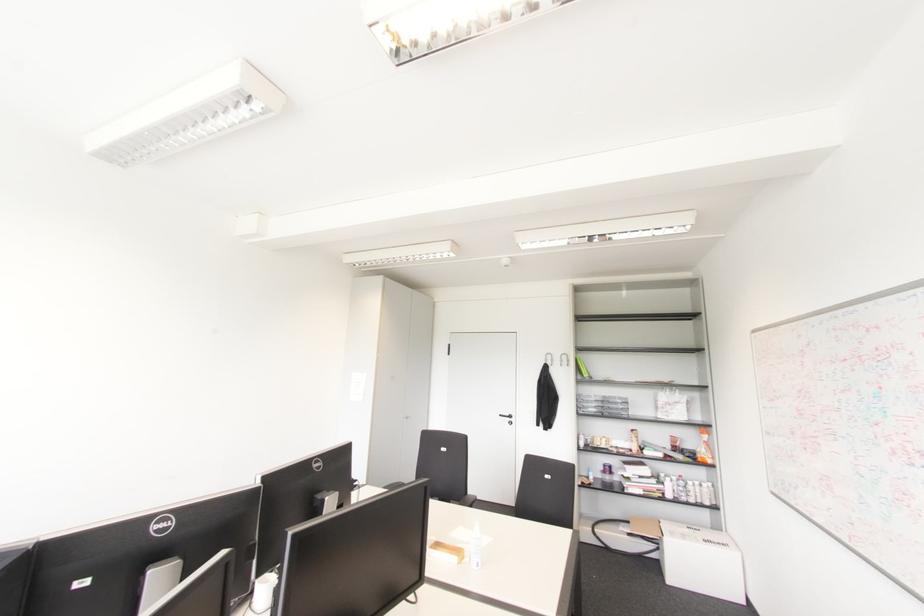
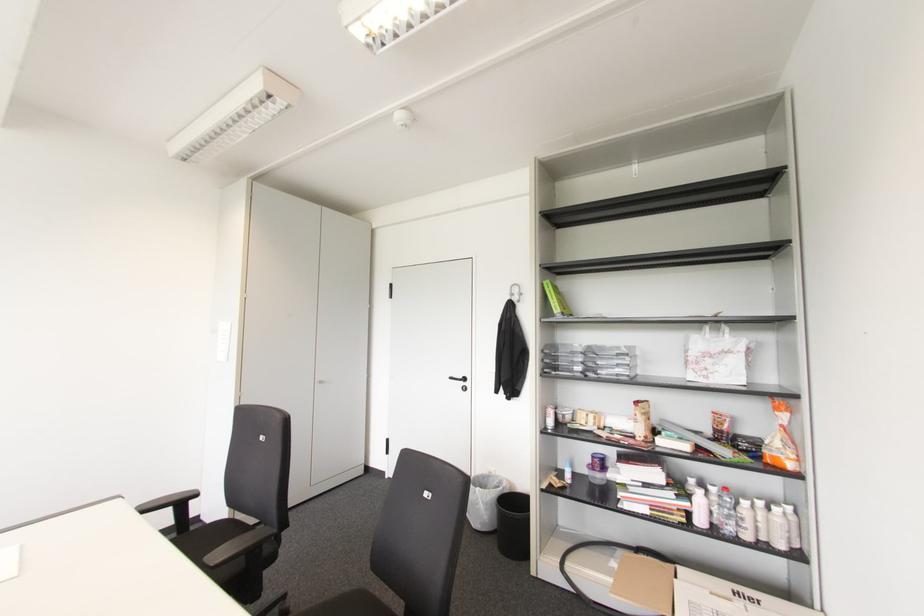
Where in the second image is the point corresponding to the point at 690,500 from the first image?

(747, 536)